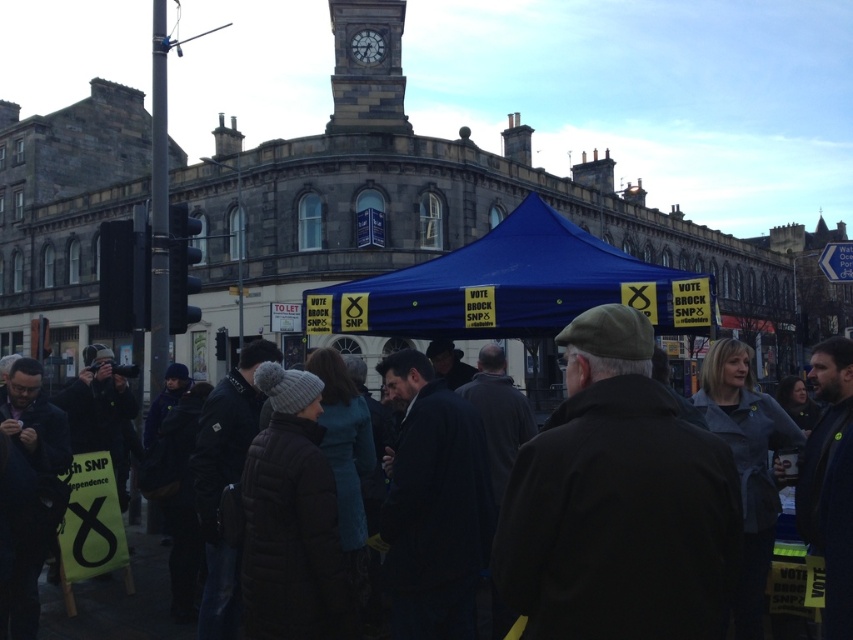
You are a photographer at the town square event and want to capture both the dark brown woolen coat at center and the dark gray wool coat at center in a single photo. Which coat should you position to the left side in your camera frame to ensure both are visible?

The dark brown woolen coat at center is positioned on the right side of dark gray wool coat at center. To ensure both are visible, you should position the dark gray wool coat at center to the left side in your camera frame so that the dark brown woolen coat at center naturally appears on the right.

You are a photographer standing at the point marked by the coordinates (618, 502). What object is directly in front of you?

The point marked by the coordinates (618, 502) indicates the location of the dark brown woolen coat at center, so the object directly in front of you is the dark brown woolen coat at center.

You are standing at the town square and want to walk from point A to point B. Point A is at coordinates point (x=624, y=579) and point B is at coordinates point (x=115, y=630). Considering the crowd around the blue canopy tent promoting the SNP, will you pass in front of or behind the tent when moving from point A to point B?

Point (x=624, y=579) is in front of point (x=115, y=630), so when moving from point A to point B, you will be moving towards a position that is behind the tent. Therefore, you will pass behind the tent.